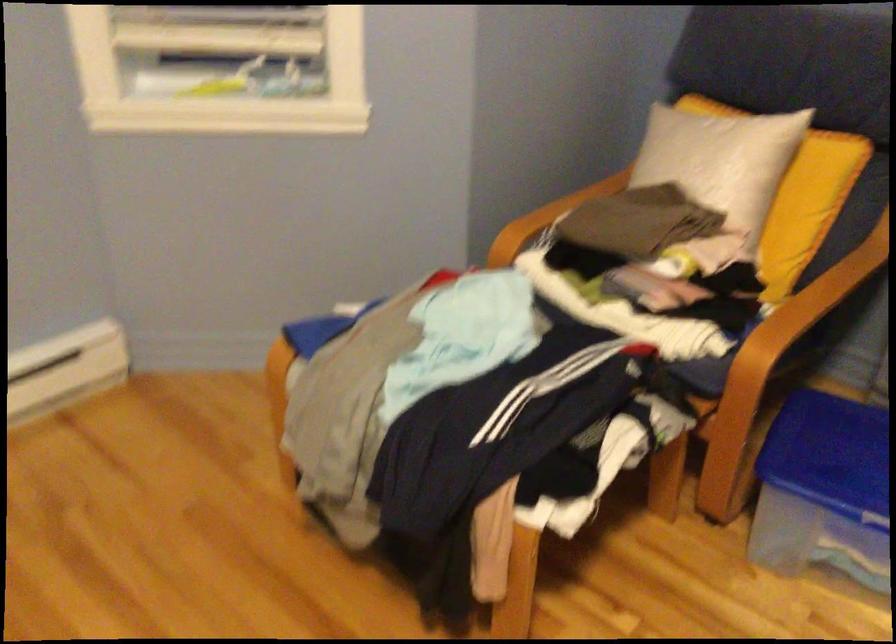
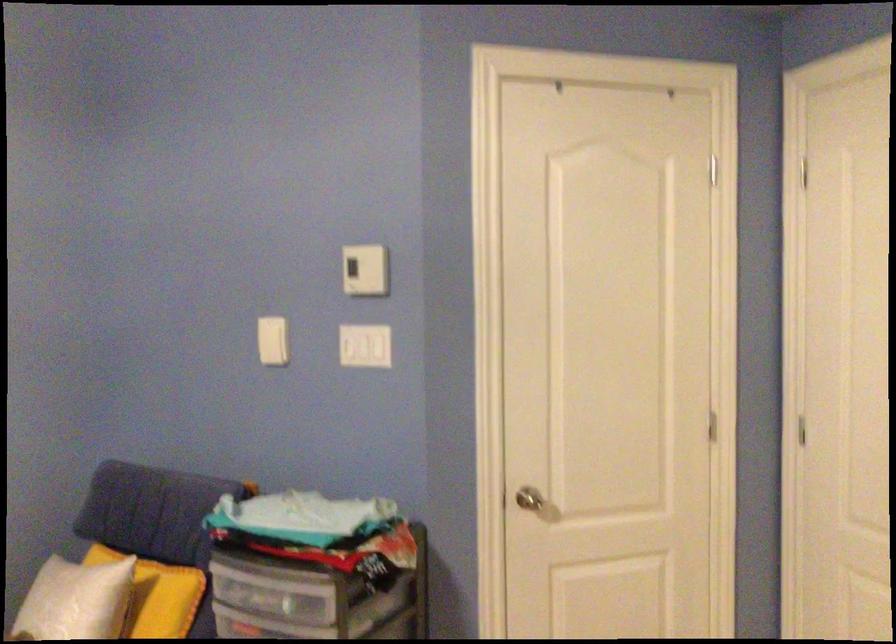
Question: I am providing you with two images of the same scene from different viewpoints. Please identify which objects are invisible in image2.

Choices:
 (A) yellow pillow
 (B) white rocker switch
 (C) silver door knob
 (D) none of these

Answer: (D)